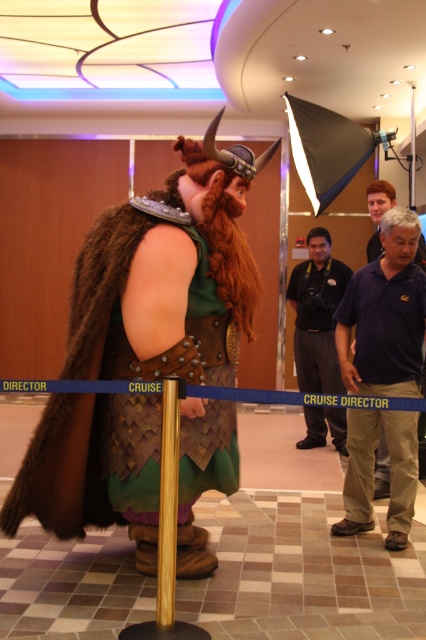
Question: Which of the following is the closest to the observer?

Choices:
 (A) (344, 532)
 (B) (97, 509)

Answer: (B)

Question: Does fur-like cape at center appear over dark gray uniform at center?

Choices:
 (A) yes
 (B) no

Answer: (B)

Question: Can you confirm if fur-like cape at center is smaller than dark gray uniform at center?

Choices:
 (A) yes
 (B) no

Answer: (B)

Question: Can you confirm if fur-like cape at center is positioned to the right of blue cotton polo shirt at center?

Choices:
 (A) no
 (B) yes

Answer: (A)

Question: Estimate the real-world distances between objects in this image. Which object is closer to the blue cotton polo shirt at center?

Choices:
 (A) fur-like cape at center
 (B) dark gray uniform at center

Answer: (A)

Question: Among these points, which one is nearest to the camera?

Choices:
 (A) (322, 234)
 (B) (400, 520)

Answer: (B)